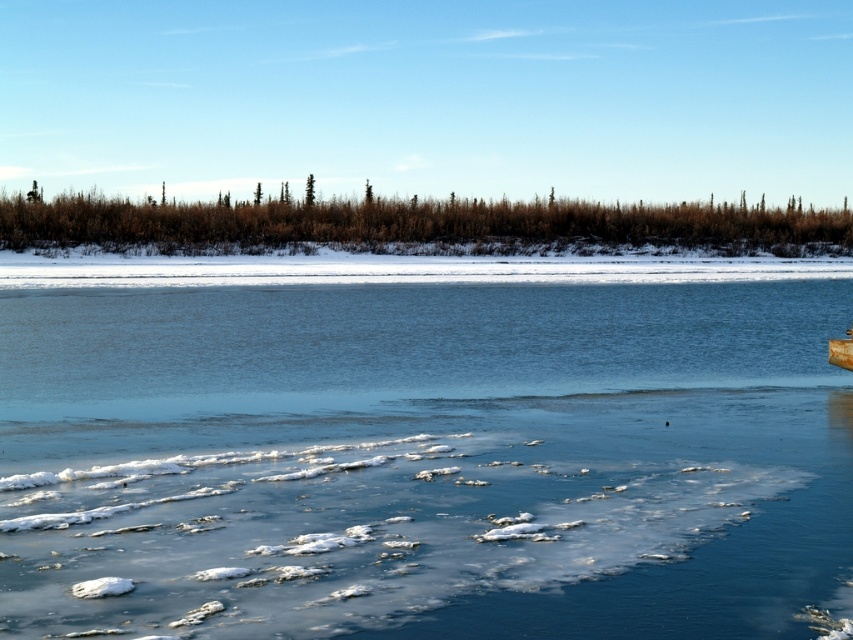
Does translucent ice at center have a greater width compared to wooden canoe at lower right?

Indeed, translucent ice at center has a greater width compared to wooden canoe at lower right.

Between translucent ice at center and wooden canoe at lower right, which one appears on the left side from the viewer's perspective?

translucent ice at center is more to the left.

Is point (459, 339) less distant than point (834, 353)?

No.

Find the location of a particular element. translucent ice at center is located at coordinates (422, 445).